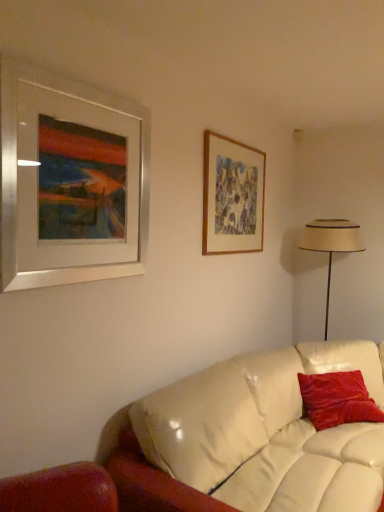
Question: In the image, is beige fabric lampshade at right positioned in front of or behind velvet red pillow at right?

Choices:
 (A) front
 (B) behind

Answer: (B)

Question: Is beige fabric lampshade at right taller or shorter than velvet red pillow at right?

Choices:
 (A) tall
 (B) short

Answer: (A)

Question: Which object is the closest to the wooden picture frame at upper right, which is counted as the second picture frame, starting from the front?

Choices:
 (A) velvet red pillow at right
 (B) beige fabric lampshade at right
 (C) silver metallic picture frame at upper left, which is the second picture frame in right-to-left order

Answer: (B)

Question: Which object is the farthest from the wooden picture frame at upper right, placed as the 1th picture frame when sorted from right to left?

Choices:
 (A) beige fabric lampshade at right
 (B) velvet red pillow at right
 (C) silver metallic picture frame at upper left, arranged as the first picture frame when viewed from the left

Answer: (B)